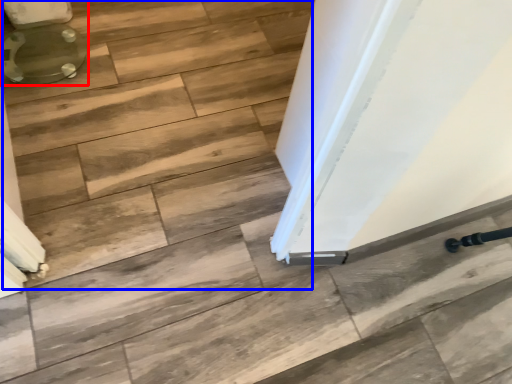
Question: Which point is closer to the camera, toilet (highlighted by a red box) or stair (highlighted by a blue box)?

Choices:
 (A) toilet
 (B) stair

Answer: (B)